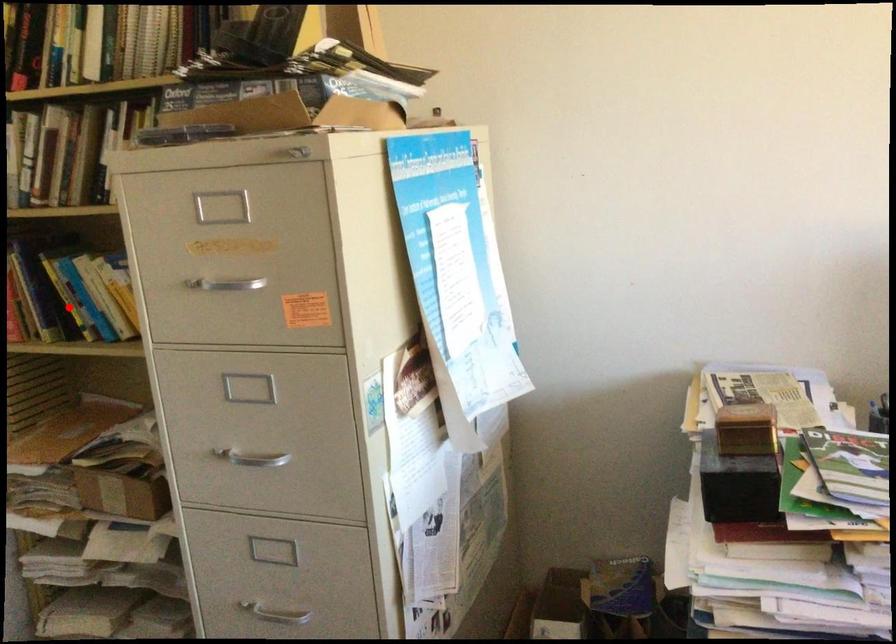
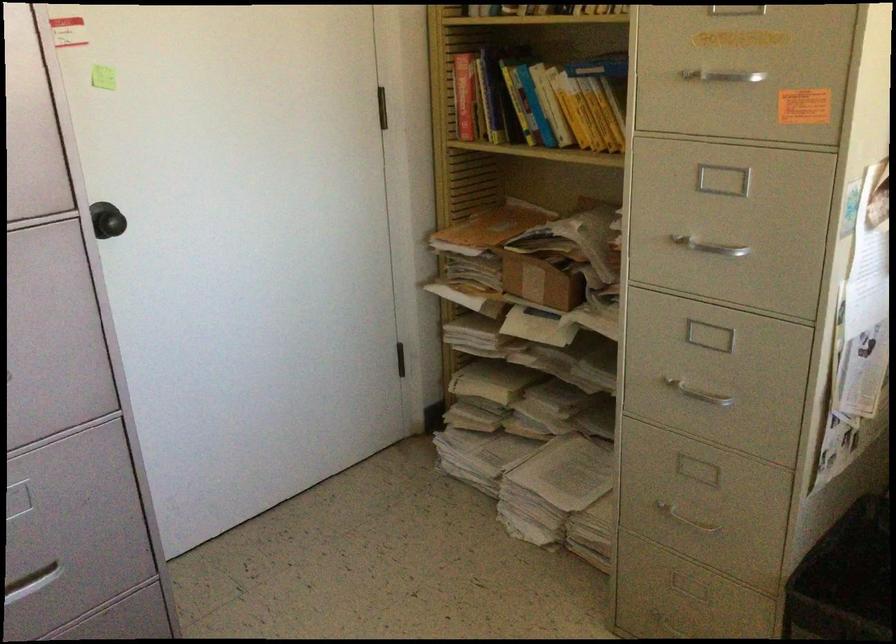
Locate, in the second image, the point that corresponds to the highlighted location in the first image.

(523, 111)